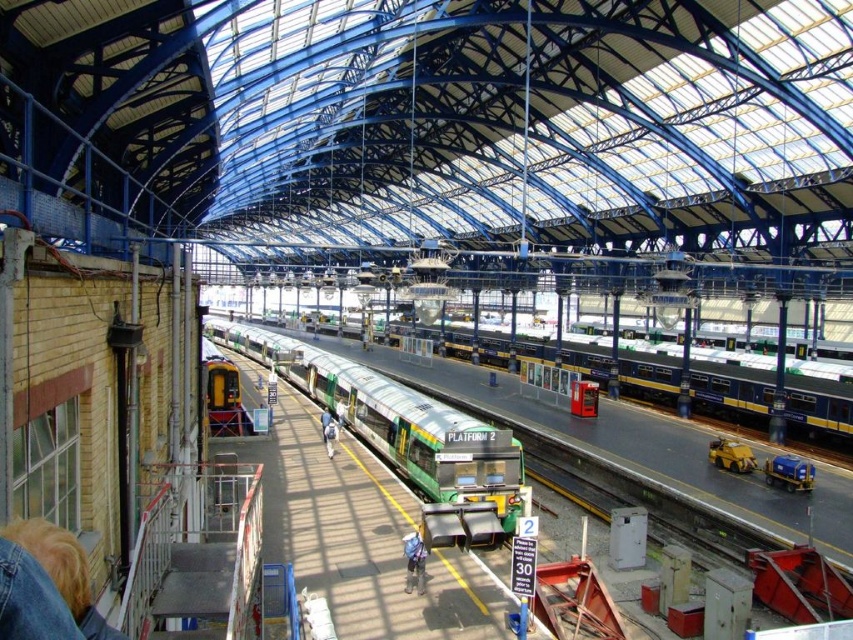
Question: Which point is farther to the camera?

Choices:
 (A) blonde hair at lower left
 (B) denim jacket at lower center
 (C) blue fabric backpack at center
 (D) green metallic train at center

Answer: (C)

Question: Can you confirm if denim jacket at lower center is positioned to the left of blue fabric backpack at center?

Choices:
 (A) no
 (B) yes

Answer: (A)

Question: Which point appears closest to the camera in this image?

Choices:
 (A) (325, 433)
 (B) (344, 422)
 (C) (0, 532)

Answer: (C)

Question: Does blonde hair at lower left appear on the right side of blue denim jacket at center?

Choices:
 (A) no
 (B) yes

Answer: (B)

Question: Does blonde hair at lower left appear on the left side of denim jacket at lower center?

Choices:
 (A) yes
 (B) no

Answer: (A)

Question: Which point is farther from the camera taking this photo?

Choices:
 (A) (337, 435)
 (B) (408, 580)
 (C) (491, 477)

Answer: (A)